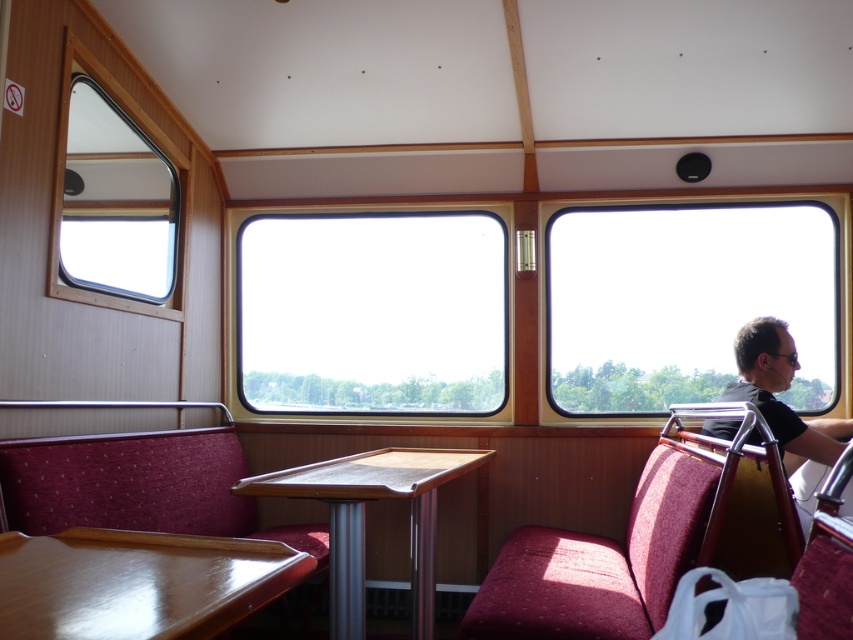
Question: Considering the real-world distances, which object is farthest from the wooden/metallic table at center?

Choices:
 (A) maroon fabric chair at right
 (B) wooden table at lower left
 (C) clear glass window at center
 (D) matte black shirt at right

Answer: (D)

Question: Is clear glass window at upper left below matte black shirt at right?

Choices:
 (A) yes
 (B) no

Answer: (B)

Question: Which object is positioned closest to the clear glass window at center?

Choices:
 (A) transparent glass window at right
 (B) clear glass window at upper left
 (C) wooden/metallic table at center

Answer: (A)

Question: Can you confirm if maroon fabric chair at right is positioned to the left of velvet maroon chair at lower left?

Choices:
 (A) yes
 (B) no

Answer: (B)

Question: Among these points, which one is farthest from the camera?

Choices:
 (A) (485, 310)
 (B) (753, 342)

Answer: (A)

Question: Can you confirm if maroon fabric chair at right is positioned to the left of wooden table at lower left?

Choices:
 (A) no
 (B) yes

Answer: (A)